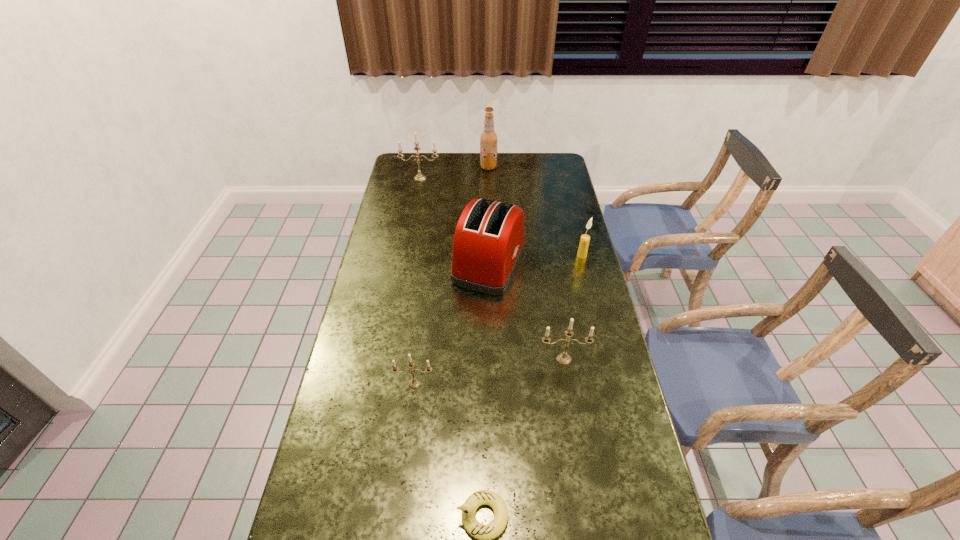
Find the location of `the sixth farthest object`. the sixth farthest object is located at coordinates (414, 382).

Image resolution: width=960 pixels, height=540 pixels. Identify the location of blank space located on the front label of the beer bottle. (420, 167).

Locate an element on the screen. vacant region located 0.070m on the front label of the beer bottle is located at coordinates (465, 167).

Locate an element on the screen. free space located on the front label of the beer bottle is located at coordinates (404, 167).

This screenshot has height=540, width=960. I want to click on blank space located 0.280m on the left of the red toaster, so click(x=374, y=264).

The width and height of the screenshot is (960, 540). Find the location of `free space located 0.150m on the front of the farthest candle`. free space located 0.150m on the front of the farthest candle is located at coordinates (417, 200).

Find the location of a particular element. This screenshot has width=960, height=540. vacant region located on the front of the cream candle is located at coordinates (586, 270).

Find the location of a particular element. The height and width of the screenshot is (540, 960). vacant space situated on the left of the third farthest candle is located at coordinates (474, 359).

Find the location of `vacant space located on the right of the shortest candle`. vacant space located on the right of the shortest candle is located at coordinates (540, 383).

The width and height of the screenshot is (960, 540). I want to click on beer bottle at the far edge, so click(488, 139).